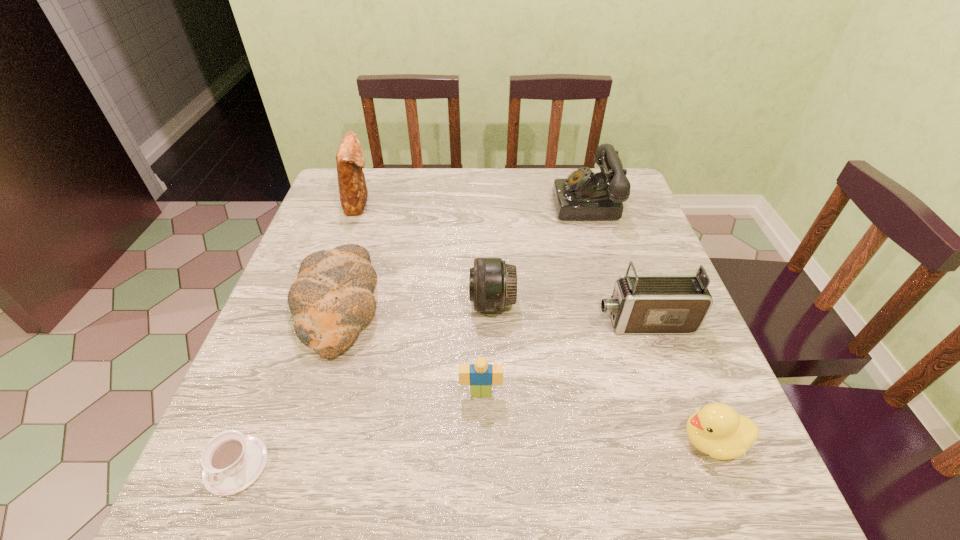
Image resolution: width=960 pixels, height=540 pixels. What are the coordinates of `free space located 0.240m on the dial of the telephone` in the screenshot? It's located at (469, 204).

This screenshot has width=960, height=540. Find the location of `free space located 0.230m on the dial of the telephone`. free space located 0.230m on the dial of the telephone is located at coordinates (473, 204).

In order to click on free spot located 0.180m at the lens of the camcorder in this screenshot , I will do `click(512, 322)`.

Find the location of `free space located 0.330m at the lens of the camcorder`. free space located 0.330m at the lens of the camcorder is located at coordinates (442, 322).

Locate an element on the screen. The height and width of the screenshot is (540, 960). vacant position located at the lens of the camcorder is located at coordinates (553, 322).

Identify the location of free space located 0.190m on the front-facing side of the telephoto lens. The height and width of the screenshot is (540, 960). (385, 303).

The width and height of the screenshot is (960, 540). Identify the location of free space located 0.160m on the front-facing side of the telephoto lens. (398, 303).

Image resolution: width=960 pixels, height=540 pixels. Identify the location of free space located on the front-facing side of the telephoto lens. (434, 303).

Locate an element on the screen. The width and height of the screenshot is (960, 540). vacant position located 0.180m on the front of the bread is located at coordinates (294, 453).

The image size is (960, 540). Identify the location of vacant space located 0.140m on the face of the Lego. coord(481,475).